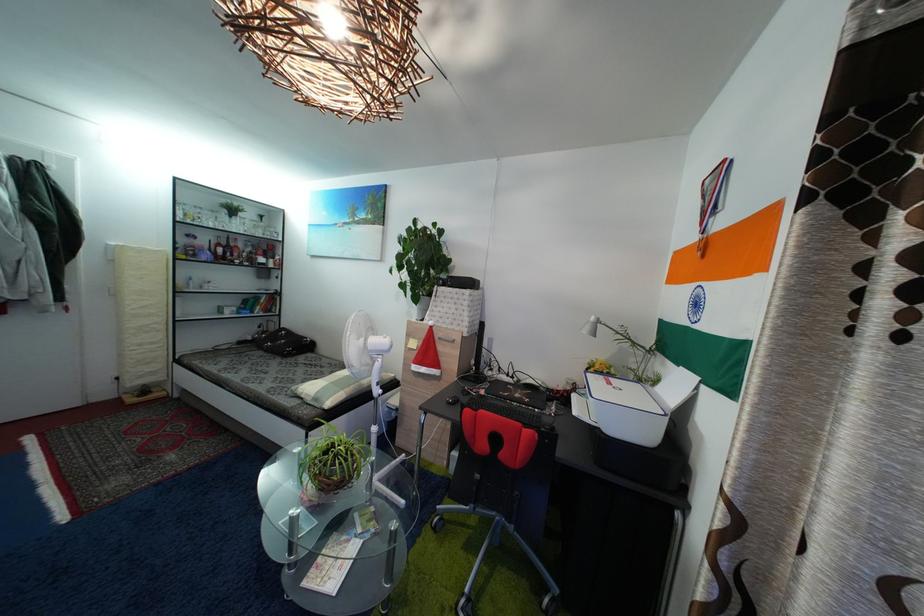
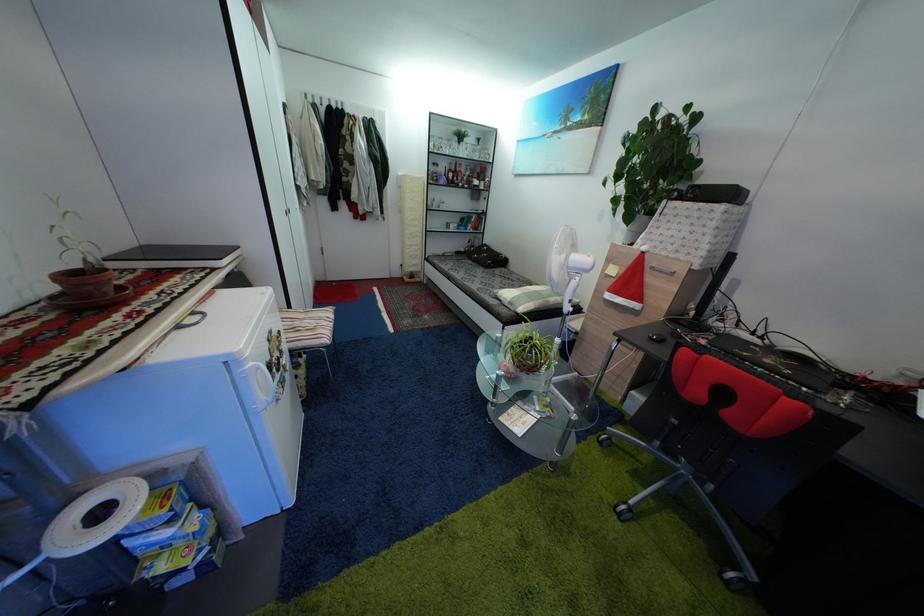
From the picture: The images are taken continuously from a first-person perspective. In which direction is your viewpoint rotating?

The rotation direction of the camera is left-down.